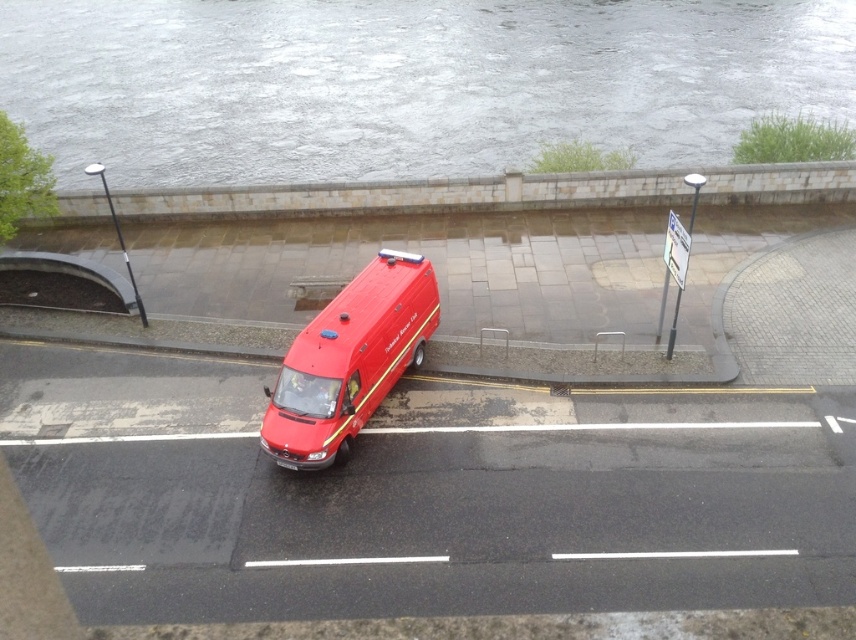
Question: Does stone at upper center appear on the right side of shiny red van at center?

Choices:
 (A) yes
 (B) no

Answer: (A)

Question: Considering the real-world distances, which object is closest to the stone at upper center?

Choices:
 (A) shiny red van at center
 (B) gray stone wall at upper center

Answer: (A)

Question: Is shiny red van at center smaller than white plastic sign at upper right?

Choices:
 (A) no
 (B) yes

Answer: (A)

Question: Which point is farther from the camera taking this photo?

Choices:
 (A) (378, 362)
 (B) (266, 122)

Answer: (B)

Question: Considering the real-world distances, which object is farthest from the gray stone wall at upper center?

Choices:
 (A) stone at upper center
 (B) white plastic sign at upper right
 (C) shiny red van at center

Answer: (B)

Question: Is shiny red van at center to the left of white plastic sign at upper right from the viewer's perspective?

Choices:
 (A) yes
 (B) no

Answer: (A)